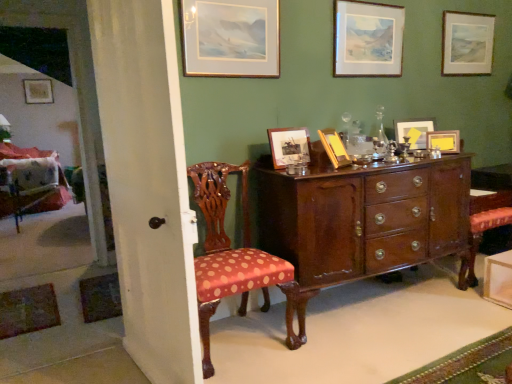
Question: Considering the relative sizes of polished wood cabinet at center and matte wooden picture frame at upper right, the second picture frame when ordered from back to front, in the image provided, is polished wood cabinet at center shorter than matte wooden picture frame at upper right, the second picture frame when ordered from back to front,?

Choices:
 (A) yes
 (B) no

Answer: (B)

Question: Does polished wood cabinet at center turn towards matte wooden picture frame at upper right, acting as the 1th picture frame starting from the right?

Choices:
 (A) yes
 (B) no

Answer: (B)

Question: Is there a large distance between polished wood cabinet at center and matte wooden picture frame at upper right, the eighth picture frame when ordered from left to right?

Choices:
 (A) yes
 (B) no

Answer: (A)

Question: From a real-world perspective, does polished wood cabinet at center stand above matte wooden picture frame at upper right, the eighth picture frame when ordered from left to right?

Choices:
 (A) no
 (B) yes

Answer: (A)

Question: Can you confirm if polished wood cabinet at center is bigger than matte wooden picture frame at upper right, the second picture frame when ordered from back to front?

Choices:
 (A) yes
 (B) no

Answer: (A)

Question: Is point (330, 132) closer or farther from the camera than point (349, 69)?

Choices:
 (A) closer
 (B) farther

Answer: (A)

Question: From the image's perspective, is wooden picture frame at center, acting as the 4th picture frame starting from the left, positioned above or below wooden picture frame at upper center, which is counted as the 4th picture frame, starting from the front?

Choices:
 (A) below
 (B) above

Answer: (A)

Question: From their relative heights in the image, would you say wooden picture frame at center, arranged as the fifth picture frame when viewed from the right, is taller or shorter than wooden picture frame at upper center, the fourth picture frame when ordered from right to left?

Choices:
 (A) tall
 (B) short

Answer: (B)

Question: Is wooden picture frame at center, acting as the 4th picture frame starting from the left, in front of or behind wooden picture frame at upper center, which is counted as the 5th picture frame, starting from the left, in the image?

Choices:
 (A) front
 (B) behind

Answer: (A)

Question: Relative to polka dot fabric chair at left, which is the 1th chair from back to front, is matte wooden picture frame at upper right, acting as the 1th picture frame starting from the right, in front or behind?

Choices:
 (A) behind
 (B) front

Answer: (B)

Question: Is matte wooden picture frame at upper right, the second picture frame when ordered from back to front, bigger or smaller than polka dot fabric chair at left, the 2th chair viewed from the right?

Choices:
 (A) small
 (B) big

Answer: (A)

Question: Is point (467, 51) positioned closer to the camera than point (60, 180)?

Choices:
 (A) closer
 (B) farther

Answer: (A)

Question: Would you say matte wooden picture frame at upper right, acting as the 1th picture frame starting from the right, is to the left or to the right of polka dot fabric chair at left, which is the 2th chair in front-to-back order, in the picture?

Choices:
 (A) left
 (B) right

Answer: (B)

Question: Based on their positions, is polka dot fabric chair at left, which is the 2th chair in front-to-back order, located to the left or right of wooden picture frame at center, acting as the 6th picture frame starting from the back?

Choices:
 (A) right
 (B) left

Answer: (B)

Question: Is polka dot fabric chair at left, the 2th chair viewed from the right, wider or thinner than wooden picture frame at center, acting as the 6th picture frame starting from the back?

Choices:
 (A) wide
 (B) thin

Answer: (A)